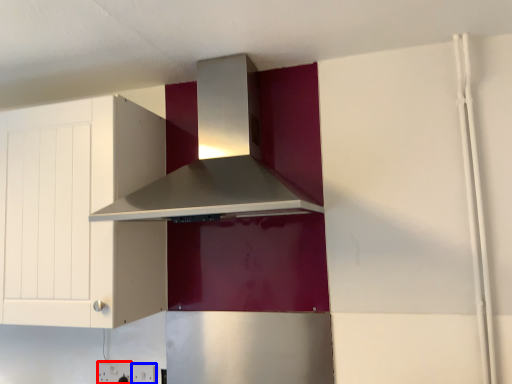
Question: Which object is closer to the camera taking this photo, electric outlet (highlighted by a red box) or electric outlet (highlighted by a blue box)?

Choices:
 (A) electric outlet
 (B) electric outlet

Answer: (B)